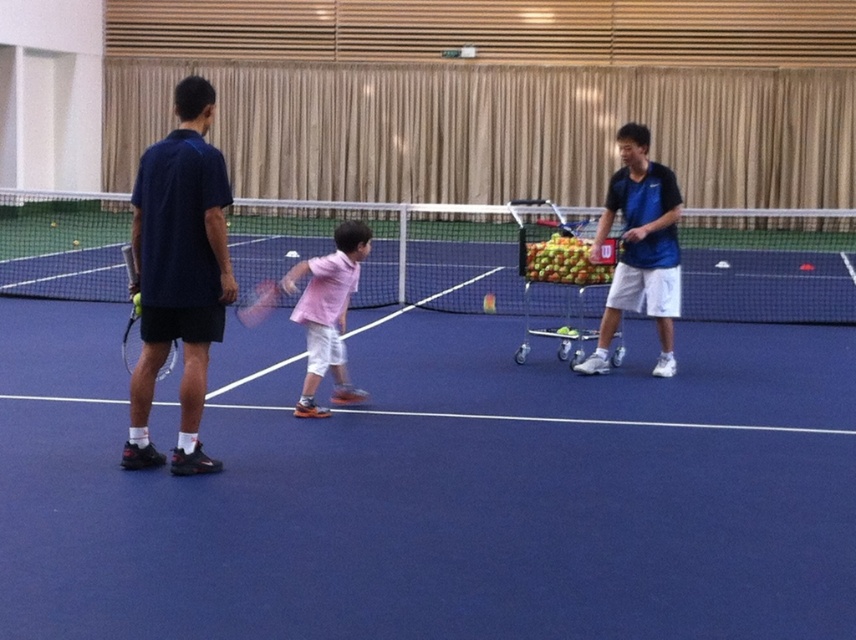
You are a tennis instructor standing on the court. You notice the green matte tennis ball at center and the matte black tennis racket at left. Can you determine if the ball is positioned higher than the racket?

The green matte tennis ball at center is above the matte black tennis racket at left, so yes, the ball is positioned higher than the racket.

You are a tennis instructor standing on the court. You need to set up a practice drill where the child must hit the ball over the white mesh net at center and avoid the blue matte tennis cart at right. Which object should the child aim to clear first, and why?

The child should aim to clear the white mesh net at center first because it is much taller than the blue matte tennis cart at right, so the ball needs to reach a higher point to pass over the net without hitting it.